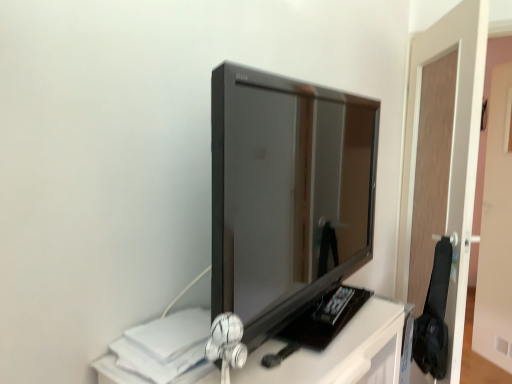
Question: Is glossy black tv at center positioned far away from brown wooden door at right?

Choices:
 (A) no
 (B) yes

Answer: (A)

Question: Does glossy black tv at center lie behind brown wooden door at right?

Choices:
 (A) no
 (B) yes

Answer: (A)

Question: From the image's perspective, is glossy black tv at center located beneath brown wooden door at right?

Choices:
 (A) yes
 (B) no

Answer: (B)

Question: Is glossy black tv at center wider than brown wooden door at right?

Choices:
 (A) yes
 (B) no

Answer: (A)

Question: Can you confirm if glossy black tv at center is taller than brown wooden door at right?

Choices:
 (A) no
 (B) yes

Answer: (A)

Question: Is glossy black tv at center positioned in front of brown wooden door at right?

Choices:
 (A) yes
 (B) no

Answer: (A)

Question: Can you confirm if brown wooden door at right is taller than glossy black tv at center?

Choices:
 (A) yes
 (B) no

Answer: (A)

Question: Is brown wooden door at right shorter than glossy black tv at center?

Choices:
 (A) yes
 (B) no

Answer: (B)

Question: Is brown wooden door at right oriented towards glossy black tv at center?

Choices:
 (A) yes
 (B) no

Answer: (A)

Question: Is brown wooden door at right bigger than glossy black tv at center?

Choices:
 (A) no
 (B) yes

Answer: (B)

Question: Considering the relative positions of brown wooden door at right and glossy black tv at center in the image provided, is brown wooden door at right to the left of glossy black tv at center from the viewer's perspective?

Choices:
 (A) no
 (B) yes

Answer: (A)

Question: From a real-world perspective, is brown wooden door at right beneath glossy black tv at center?

Choices:
 (A) no
 (B) yes

Answer: (B)

Question: Is brown wooden door at right inside or outside of glossy black tv at center?

Choices:
 (A) outside
 (B) inside

Answer: (A)